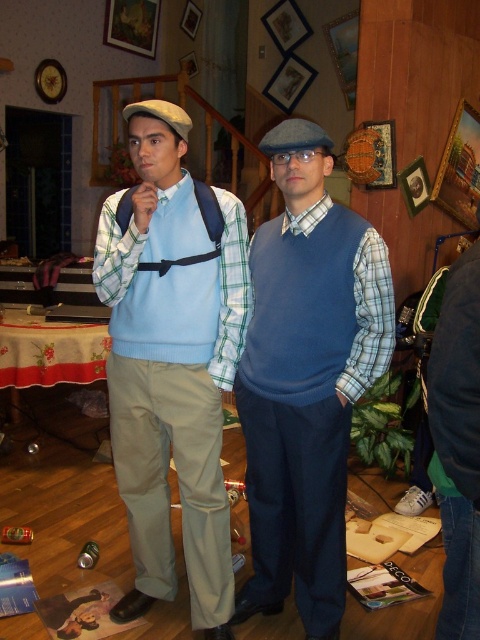
You are a tailor examining the clothing items in the image. You need to determine which item has a larger size between the matte blue fabric suspenders at center and the blue wool sweater vest at center. Which one is bigger?

The matte blue fabric suspenders at center has a larger size compared to the blue wool sweater vest at center, so the suspenders are bigger.

You are a fashion designer analyzing clothing layers in the image. Which clothing item is positioned higher on the person wearing them, the matte blue fabric suspenders at center or the blue wool sweater vest at center?

Answer: The matte blue fabric suspenders at center are positioned above the blue wool sweater vest at center, so the suspenders are higher.